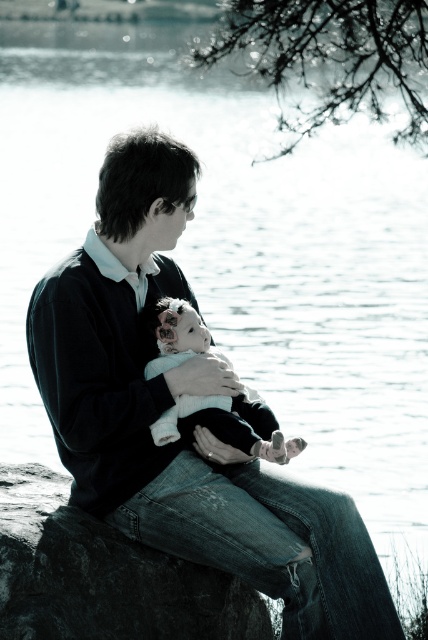
Question: Among these objects, which one is nearest to the camera?

Choices:
 (A) dark gray rock at lower left
 (B) fluffy white teddy bear at center
 (C) dark blue jeans at center

Answer: (A)

Question: Estimate the real-world distances between objects in this image. Which object is farther from the dark gray rock at lower left?

Choices:
 (A) fluffy white teddy bear at center
 (B) dark blue jeans at center

Answer: (A)

Question: Can you confirm if dark gray rock at lower left is thinner than fluffy white teddy bear at center?

Choices:
 (A) yes
 (B) no

Answer: (B)

Question: Among these points, which one is nearest to the camera?

Choices:
 (A) (208, 401)
 (B) (109, 440)

Answer: (B)

Question: Is the position of dark blue jeans at center less distant than that of fluffy white teddy bear at center?

Choices:
 (A) yes
 (B) no

Answer: (A)

Question: Is dark gray rock at lower left thinner than fluffy white teddy bear at center?

Choices:
 (A) yes
 (B) no

Answer: (B)